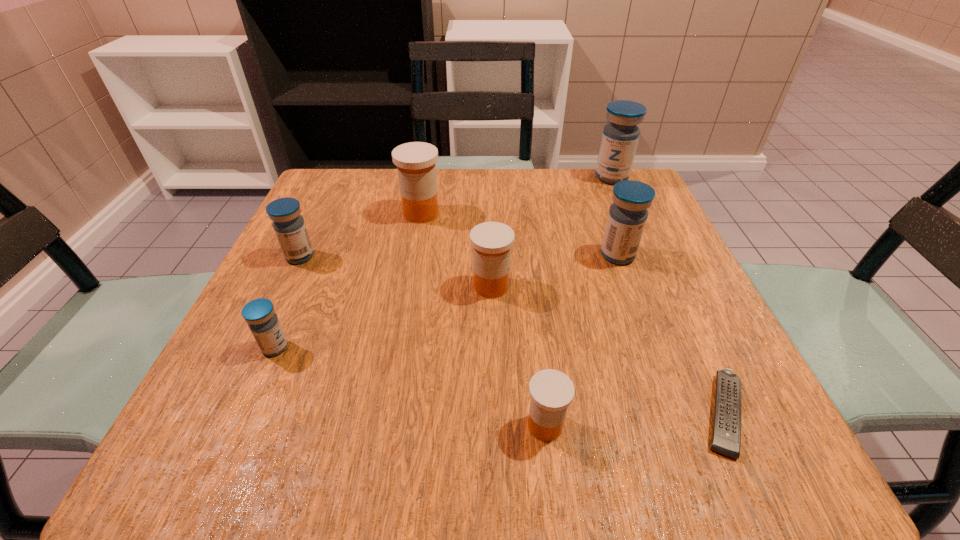
Image resolution: width=960 pixels, height=540 pixels. What are the coordinates of `vacant space located on the front of the sixth farthest object` in the screenshot? It's located at (228, 456).

What are the coordinates of `blank space located on the label of the nearest orange medicine` in the screenshot? It's located at click(338, 426).

Where is `vacant space positioned 0.230m on the label of the nearest orange medicine`? vacant space positioned 0.230m on the label of the nearest orange medicine is located at coordinates [359, 426].

Where is `vacant space situated 0.170m on the label of the nearest orange medicine`? vacant space situated 0.170m on the label of the nearest orange medicine is located at coordinates (402, 426).

The height and width of the screenshot is (540, 960). Find the location of `free space located 0.360m on the left of the shortest object`. free space located 0.360m on the left of the shortest object is located at coordinates (441, 413).

The height and width of the screenshot is (540, 960). I want to click on medicine present at the near edge, so click(551, 391).

Locate an element on the screen. The image size is (960, 540). remote control located in the near edge section of the desktop is located at coordinates (726, 434).

Identify the location of remote control at the right edge. (726, 434).

This screenshot has height=540, width=960. In order to click on object situated at the far right corner in this screenshot , I will do `click(620, 136)`.

I want to click on object present at the near right corner, so click(726, 434).